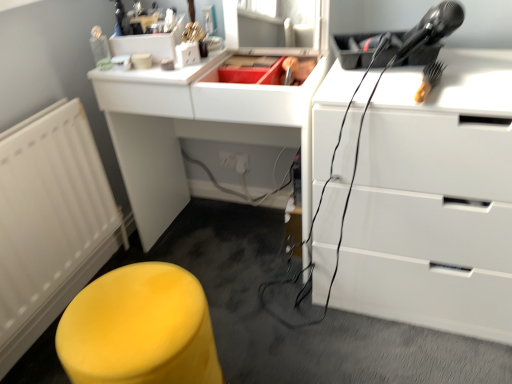
Question: From the image's perspective, is white matte radiator at left on yellow plastic brush at upper right?

Choices:
 (A) no
 (B) yes

Answer: (A)

Question: From the image's perspective, is white matte radiator at left under yellow plastic brush at upper right?

Choices:
 (A) yes
 (B) no

Answer: (A)

Question: Considering the relative sizes of white matte radiator at left and yellow plastic brush at upper right in the image provided, is white matte radiator at left wider than yellow plastic brush at upper right?

Choices:
 (A) yes
 (B) no

Answer: (B)

Question: Considering the relative positions of white matte radiator at left and yellow plastic brush at upper right in the image provided, is white matte radiator at left to the right of yellow plastic brush at upper right from the viewer's perspective?

Choices:
 (A) yes
 (B) no

Answer: (B)

Question: Is white matte radiator at left looking in the opposite direction of yellow plastic brush at upper right?

Choices:
 (A) yes
 (B) no

Answer: (B)

Question: From the image's perspective, is matte yellow stool at lower left above or below white glossy chest of drawers at upper right?

Choices:
 (A) above
 (B) below

Answer: (B)

Question: Considering their positions, is matte yellow stool at lower left located in front of or behind white glossy chest of drawers at upper right?

Choices:
 (A) front
 (B) behind

Answer: (A)

Question: Does point (177, 321) appear closer or farther from the camera than point (461, 276)?

Choices:
 (A) farther
 (B) closer

Answer: (B)

Question: In terms of height, does matte yellow stool at lower left look taller or shorter compared to white glossy chest of drawers at upper right?

Choices:
 (A) short
 (B) tall

Answer: (A)

Question: From their relative heights in the image, would you say white matte radiator at left is taller or shorter than yellow plastic brush at upper right?

Choices:
 (A) tall
 (B) short

Answer: (A)

Question: Considering the relative positions of white matte radiator at left and yellow plastic brush at upper right in the image provided, is white matte radiator at left to the left or to the right of yellow plastic brush at upper right?

Choices:
 (A) right
 (B) left

Answer: (B)

Question: Is white matte radiator at left situated inside yellow plastic brush at upper right or outside?

Choices:
 (A) outside
 (B) inside

Answer: (A)

Question: Is white matte radiator at left bigger or smaller than yellow plastic brush at upper right?

Choices:
 (A) small
 (B) big

Answer: (B)

Question: Is point (94, 225) closer or farther from the camera than point (104, 279)?

Choices:
 (A) closer
 (B) farther

Answer: (B)

Question: From a real-world perspective, is white matte radiator at left above or below matte yellow stool at lower left?

Choices:
 (A) above
 (B) below

Answer: (A)